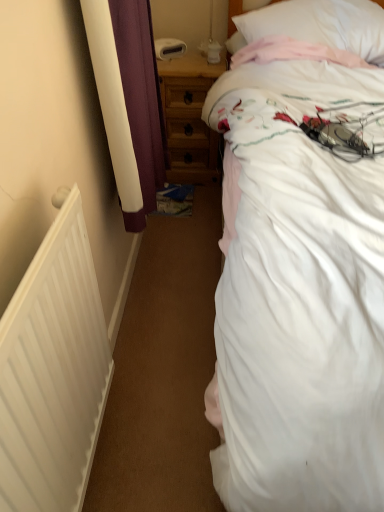
Identify the location of wooden nightstand at center. This screenshot has height=512, width=384. 189,117.

The image size is (384, 512). What do you see at coordinates (301, 262) in the screenshot?
I see `white cotton bed at upper right` at bounding box center [301, 262].

Describe the element at coordinates (321, 25) in the screenshot. The height and width of the screenshot is (512, 384). I see `white soft pillow at upper right` at that location.

The width and height of the screenshot is (384, 512). Find the location of `wooden nightstand at center`. wooden nightstand at center is located at coordinates (189, 117).

Which of these two, white matte radiator at left or white soft pillow at upper right, is bigger?

Bigger between the two is white soft pillow at upper right.

Is white matte radiator at left aimed at white soft pillow at upper right?

No, white matte radiator at left is not facing towards white soft pillow at upper right.

Is white matte radiator at left at the right side of white soft pillow at upper right?

No.

Is point (229, 86) positioned behind point (187, 86)?

No, (229, 86) is in front of (187, 86).

Considering the relative positions of white cotton bed at upper right and wooden nightstand at center in the image provided, is white cotton bed at upper right to the right of wooden nightstand at center from the viewer's perspective?

Indeed, white cotton bed at upper right is positioned on the right side of wooden nightstand at center.

Can we say white cotton bed at upper right lies outside wooden nightstand at center?

Yes.

Between white cotton bed at upper right and wooden nightstand at center, which one has more height?

With more height is white cotton bed at upper right.

From the image's perspective, which object appears higher, white soft pillow at upper right or wooden nightstand at center?

From the image's view, white soft pillow at upper right is above.

Would you say white soft pillow at upper right is a long distance from wooden nightstand at center?

white soft pillow at upper right is near wooden nightstand at center, not far away.

From the image's perspective, is white cotton bed at upper right located above white soft pillow at upper right?

No, from the image's perspective, white cotton bed at upper right is not above white soft pillow at upper right.

Which object is further away from the camera, white cotton bed at upper right or white soft pillow at upper right?

Positioned behind is white soft pillow at upper right.

Based on the photo, from a real-world perspective, which object rests below the other?

white cotton bed at upper right is physically lower.

Is white cotton bed at upper right not close to white soft pillow at upper right?

No, white cotton bed at upper right is not far from white soft pillow at upper right.

From the image's perspective, is wooden nightstand at center located beneath white soft pillow at upper right?

Indeed, from the image's perspective, wooden nightstand at center is shown beneath white soft pillow at upper right.

Choose the correct answer: Is wooden nightstand at center inside white soft pillow at upper right or outside it?

wooden nightstand at center is outside white soft pillow at upper right.

From the picture: Can you tell me how much wooden nightstand at center and white soft pillow at upper right differ in facing direction?

wooden nightstand at center and white soft pillow at upper right are facing 12.1 degrees away from each other.

Find the location of a particular element. Image resolution: width=384 pixels, height=512 pixels. nightstand behind the white soft pillow at upper right is located at coordinates (189, 117).

Which is closer, (14, 419) or (291, 396)?

The point (14, 419) is closer.

From the image's perspective, is white matte radiator at left above white cotton bed at upper right?

No, from the image's perspective, white matte radiator at left is not above white cotton bed at upper right.

From their relative heights in the image, would you say white matte radiator at left is taller or shorter than white cotton bed at upper right?

Clearly, white matte radiator at left is shorter compared to white cotton bed at upper right.

Measure the distance from white matte radiator at left to white cotton bed at upper right.

white matte radiator at left and white cotton bed at upper right are 19.29 inches apart.

Can we say white soft pillow at upper right lies outside white matte radiator at left?

white soft pillow at upper right lies outside white matte radiator at left's area.

From a real-world perspective, which is physically above, white soft pillow at upper right or white matte radiator at left?

white soft pillow at upper right is physically above.

Is white soft pillow at upper right behind white matte radiator at left?

That is True.

At what (x,y) coordinates should I click in order to perform the action: click on radiator that is under the white soft pillow at upper right (from a real-world perspective). Please return your answer as a coordinate pair (x, y). This screenshot has width=384, height=512. Looking at the image, I should click on (53, 372).

At what (x,y) coordinates should I click in order to perform the action: click on bed on the right of the wooden nightstand at center. Please return your answer as a coordinate pair (x, y). Looking at the image, I should click on (301, 262).

Based on their spatial positions, is white cotton bed at upper right or white soft pillow at upper right further from wooden nightstand at center?

white cotton bed at upper right is positioned further to the anchor wooden nightstand at center.

Estimate the real-world distances between objects in this image. Which object is further from white soft pillow at upper right, white matte radiator at left or wooden nightstand at center?

white matte radiator at left is further to white soft pillow at upper right.

Estimate the real-world distances between objects in this image. Which object is further from white soft pillow at upper right, white cotton bed at upper right or wooden nightstand at center?

Among the two, wooden nightstand at center is located further to white soft pillow at upper right.

Based on their spatial positions, is white cotton bed at upper right or white soft pillow at upper right further from white matte radiator at left?

The object further to white matte radiator at left is white soft pillow at upper right.

In the scene shown: From the image, which object appears to be farther from white cotton bed at upper right, white soft pillow at upper right or wooden nightstand at center?

wooden nightstand at center.

Considering their positions, is white cotton bed at upper right positioned closer to white matte radiator at left than wooden nightstand at center?

white cotton bed at upper right is closer to white matte radiator at left.

Which object lies nearer to the anchor point white cotton bed at upper right, white matte radiator at left or white soft pillow at upper right?

white soft pillow at upper right lies closer to white cotton bed at upper right than the other object.

From the image, which object appears to be nearer to white matte radiator at left, white soft pillow at upper right or white cotton bed at upper right?

white cotton bed at upper right lies closer to white matte radiator at left than the other object.

Where is `radiator between white cotton bed at upper right and wooden nightstand at center from front to back`? The height and width of the screenshot is (512, 384). radiator between white cotton bed at upper right and wooden nightstand at center from front to back is located at coordinates (53, 372).

Find the location of a particular element. The image size is (384, 512). pillow positioned between white matte radiator at left and wooden nightstand at center from near to far is located at coordinates (321, 25).

Where is `radiator between white cotton bed at upper right and white soft pillow at upper right along the z-axis`? The width and height of the screenshot is (384, 512). radiator between white cotton bed at upper right and white soft pillow at upper right along the z-axis is located at coordinates (53, 372).

Identify the location of pillow between white cotton bed at upper right and wooden nightstand at center along the z-axis. (321, 25).